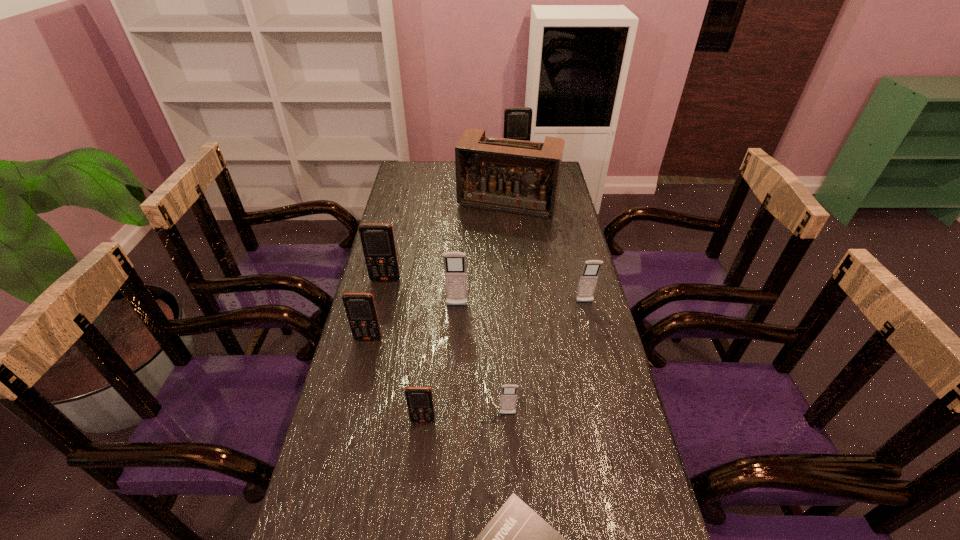
Locate an element on the screen. vacant point at the right edge is located at coordinates (556, 266).

Image resolution: width=960 pixels, height=540 pixels. In the image, there is a desktop. In order to click on vacant space at the far left corner in this screenshot , I will do click(411, 188).

Find the location of a particular element. The image size is (960, 540). free space between the third cellular telephone from right to left and the sixth cellular telephone from left to right is located at coordinates (512, 289).

You are a GUI agent. You are given a task and a screenshot of the screen. Output one action in this format:
    pyautogui.click(x=<x>, y=<y>)
    Task: Click on the vacant area that lies between the second farthest orange cellular telephone and the farthest cellular telephone
    Image resolution: width=960 pixels, height=540 pixels.
    Given the screenshot: What is the action you would take?
    pyautogui.click(x=450, y=222)

This screenshot has width=960, height=540. I want to click on free spot between the biggest gray cellular telephone and the second farthest orange cellular telephone, so coord(421,293).

You are a GUI agent. You are given a task and a screenshot of the screen. Output one action in this format:
    pyautogui.click(x=<x>, y=<y>)
    Task: Click on the free space between the third orange cellular telephone from left to right and the biggest gray cellular telephone
    The height and width of the screenshot is (540, 960).
    Given the screenshot: What is the action you would take?
    pyautogui.click(x=440, y=363)

Find the location of a particular element. free spot between the third farthest orange cellular telephone and the second biggest gray cellular telephone is located at coordinates (476, 320).

You are a GUI agent. You are given a task and a screenshot of the screen. Output one action in this format:
    pyautogui.click(x=<x>, y=<y>)
    Task: Click on the empty space that is in between the third cellular telephone from left to right and the leftmost gray cellular telephone
    The image size is (960, 540).
    Given the screenshot: What is the action you would take?
    pyautogui.click(x=440, y=363)

Locate which object ranks in proximity to the smallest gray cellular telephone. Please provide its 2D coordinates. Your answer should be formatted as a tuple, i.e. [(x, y)], where the tuple contains the x and y coordinates of a point satisfying the conditions above.

[(419, 400)]

Locate which object is the seventh closest to the second smallest gray cellular telephone. Please provide its 2D coordinates. Your answer should be formatted as a tuple, i.e. [(x, y)], where the tuple contains the x and y coordinates of a point satisfying the conditions above.

[(360, 308)]